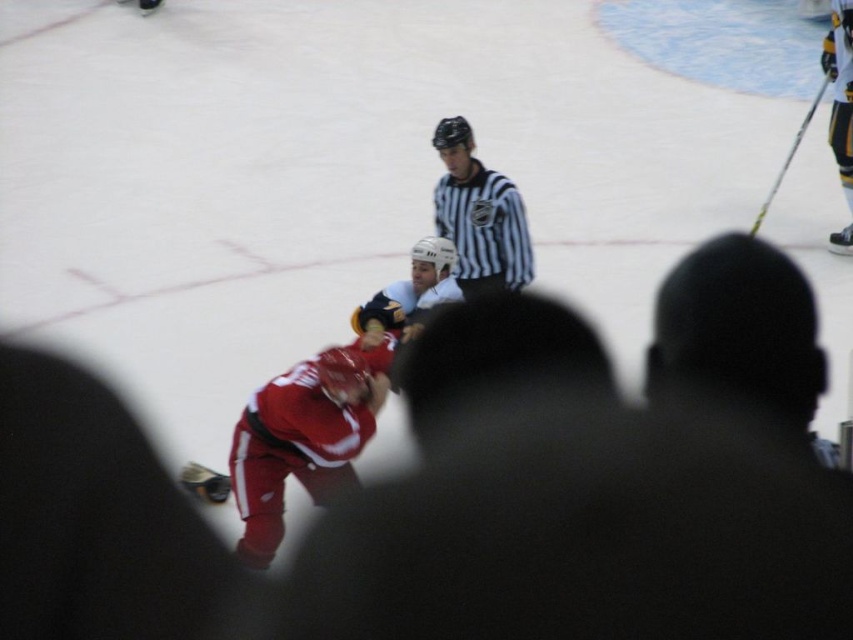
Who is positioned more to the left, striped jersey at center or black metallic hockey stick at upper right?

striped jersey at center is more to the left.

Does striped jersey at center appear on the right side of black metallic hockey stick at upper right?

No, striped jersey at center is not to the right of black metallic hockey stick at upper right.

You are a GUI agent. You are given a task and a screenshot of the screen. Output one action in this format:
    pyautogui.click(x=<x>, y=<y>)
    Task: Click on the striped jersey at center
    This screenshot has height=640, width=853.
    Given the screenshot: What is the action you would take?
    pyautogui.click(x=479, y=214)